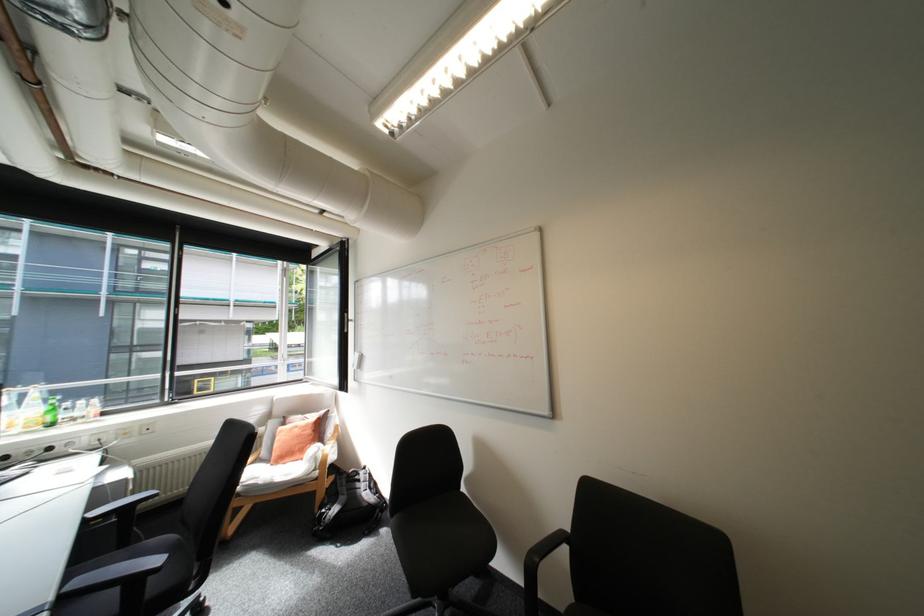
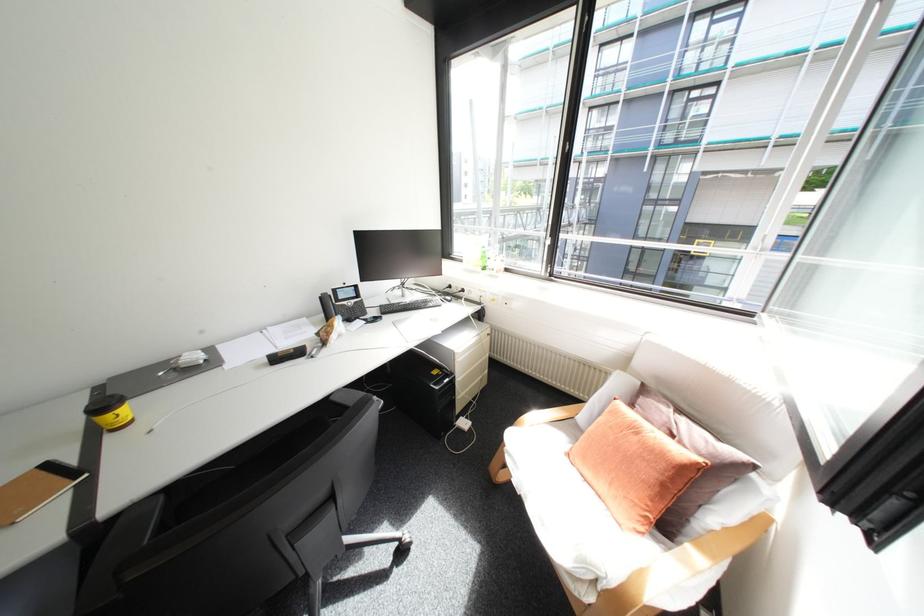
Locate, in the second image, the point that corresponds to the point at 310,416 in the first image.

(677, 410)